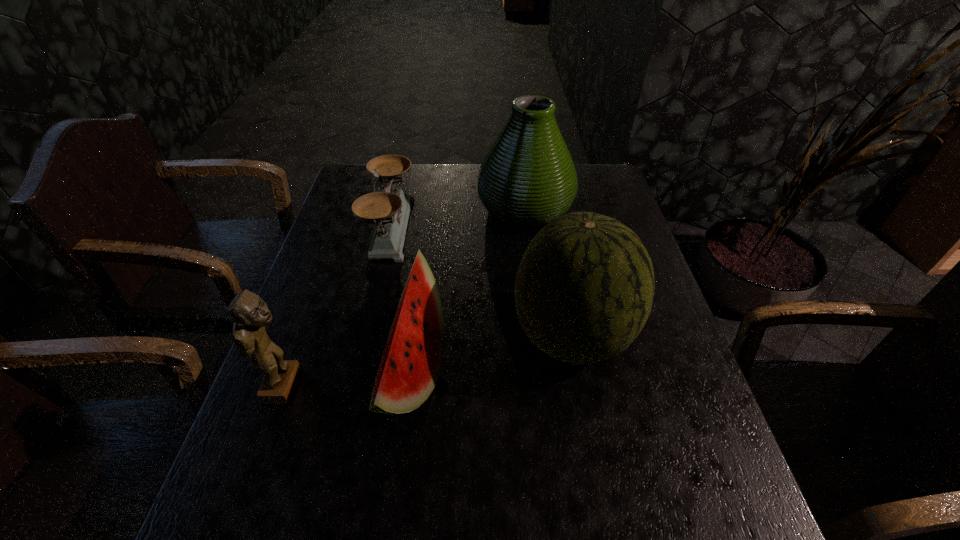
Image resolution: width=960 pixels, height=540 pixels. I want to click on vacant region between the leftmost object and the shorter watermelon, so click(x=348, y=377).

Identify which object is located as the third nearest to the scale. Please provide its 2D coordinates. Your answer should be formatted as a tuple, i.e. [(x, y)], where the tuple contains the x and y coordinates of a point satisfying the conditions above.

[(584, 289)]

Where is `the closest object to the right watermelon`? the closest object to the right watermelon is located at coordinates (410, 366).

You are a GUI agent. You are given a task and a screenshot of the screen. Output one action in this format:
    pyautogui.click(x=<x>, y=<y>)
    Task: Click on the free space that satisfies the following two spatial constraints: 1. on the front-facing side of the taller watermelon; 2. on the right side of the scale
    
    Given the screenshot: What is the action you would take?
    pyautogui.click(x=365, y=337)

Identify the location of vacant space that satisfies the following two spatial constraints: 1. on the front side of the vase; 2. on the front-facing side of the scale. (527, 227).

At what (x,y) coordinates should I click in order to perform the action: click on blank area in the image that satisfies the following two spatial constraints: 1. on the back side of the taller watermelon; 2. on the front-facing side of the scale. Please return your answer as a coordinate pair (x, y). The height and width of the screenshot is (540, 960). Looking at the image, I should click on (551, 227).

You are a GUI agent. You are given a task and a screenshot of the screen. Output one action in this format:
    pyautogui.click(x=<x>, y=<y>)
    Task: Click on the vacant region that satisfies the following two spatial constraints: 1. on the front-facing side of the scale; 2. on the right side of the right watermelon
    
    Given the screenshot: What is the action you would take?
    pyautogui.click(x=365, y=337)